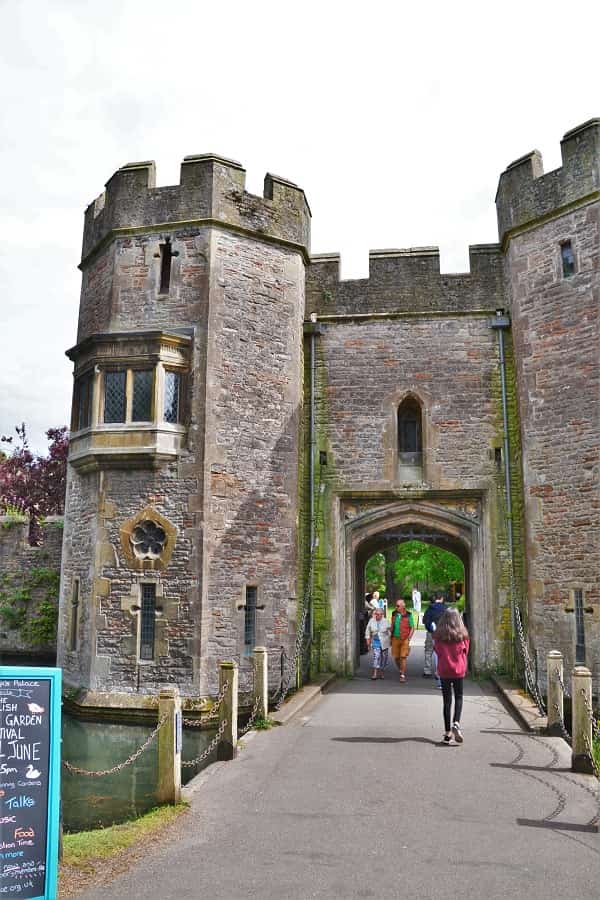
Where is `chalkboard`? The image size is (600, 900). chalkboard is located at coordinates (6, 812).